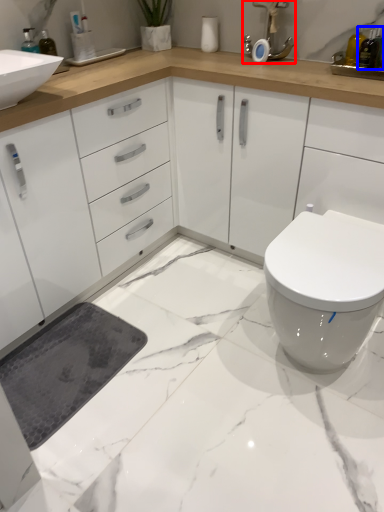
Question: Which of the following is the closest to the observer, faucet (highlighted by a red box) or toiletry (highlighted by a blue box)?

Choices:
 (A) faucet
 (B) toiletry

Answer: (B)